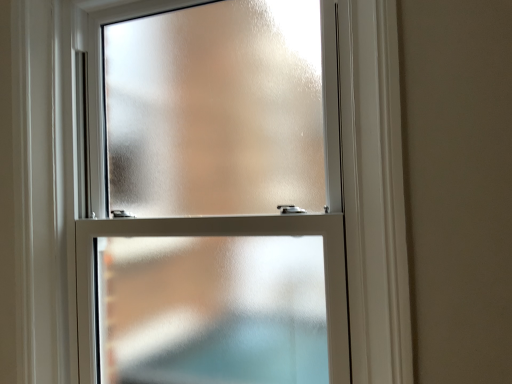
Describe the element at coordinates (374, 192) in the screenshot. I see `frosted glass window at center` at that location.

Measure the distance between point (67, 179) and camera.

Point (67, 179) is 4.84 feet away from camera.

In order to face frosted glass window at center, should I rotate leftwards or rightwards?

You should look left and rotate roughly 8.781 degrees.

You are a GUI agent. You are given a task and a screenshot of the screen. Output one action in this format:
    pyautogui.click(x=<x>, y=<y>)
    Task: Click on the frosted glass window at center
    
    Given the screenshot: What is the action you would take?
    pyautogui.click(x=374, y=192)

This screenshot has width=512, height=384. Find the location of `frosted glass window at center`. frosted glass window at center is located at coordinates (374, 192).